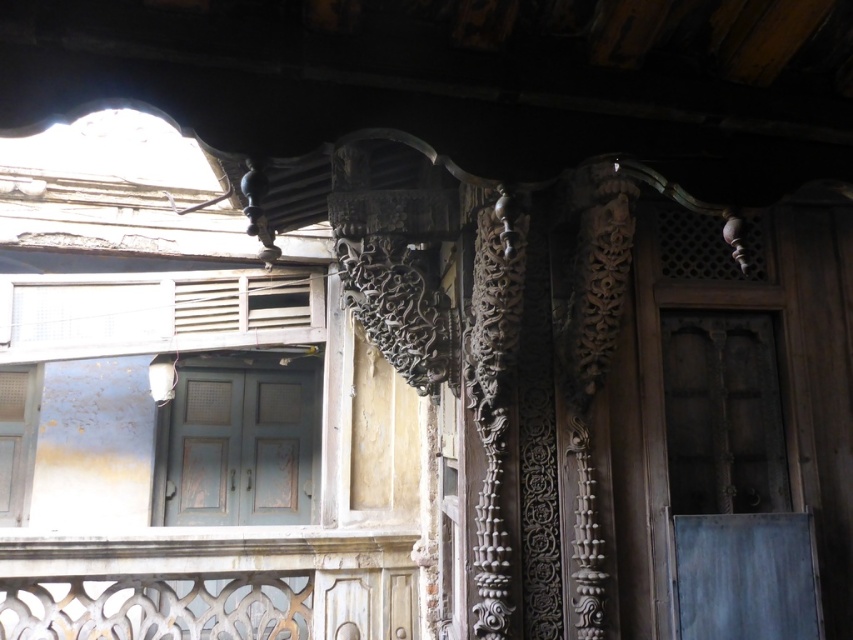
Question: Is matte blue door at center below white painted wood at lower left?

Choices:
 (A) no
 (B) yes

Answer: (B)

Question: Which object appears farthest from the camera in this image?

Choices:
 (A) matte blue door at center
 (B) white painted wood at lower left

Answer: (A)

Question: Is matte blue door at center below white painted wood at lower left?

Choices:
 (A) no
 (B) yes

Answer: (B)

Question: Is matte blue door at center smaller than white painted wood at lower left?

Choices:
 (A) no
 (B) yes

Answer: (A)

Question: Among these objects, which one is farthest from the camera?

Choices:
 (A) matte blue door at center
 (B) white painted wood at lower left

Answer: (A)